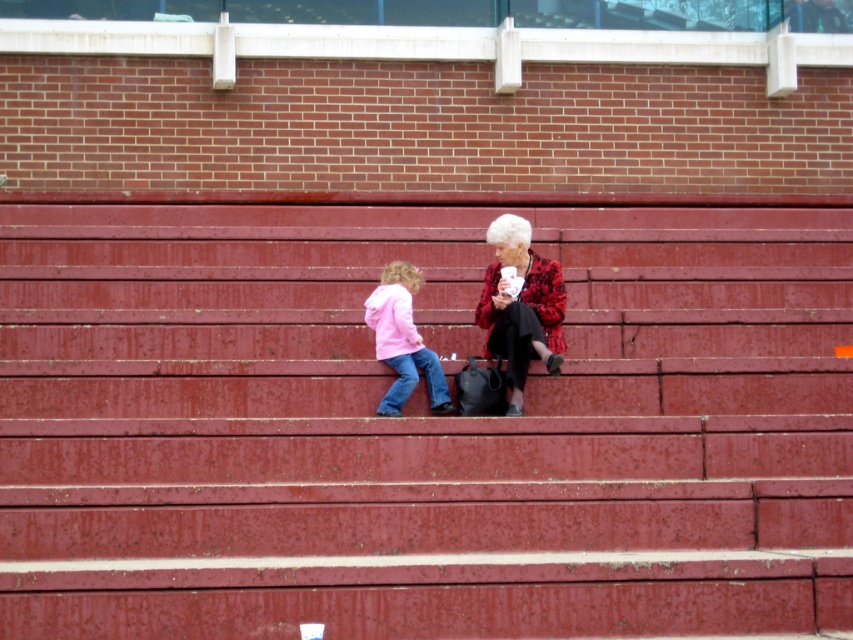
Can you confirm if smooth red stairs at center is smaller than red plaid jacket at center?

Yes.

This screenshot has height=640, width=853. Find the location of `smooth red stairs at center`. smooth red stairs at center is located at coordinates (419, 426).

Locate an element on the screen. The width and height of the screenshot is (853, 640). smooth red stairs at center is located at coordinates (419, 426).

Can you confirm if red plaid jacket at center is positioned to the right of matte pink jacket at lower left?

Correct, you'll find red plaid jacket at center to the right of matte pink jacket at lower left.

Measure the distance between red plaid jacket at center and camera.

red plaid jacket at center is 11.41 meters from camera.

Find the location of a particular element. red plaid jacket at center is located at coordinates (521, 307).

Is point (698, 557) positioned after point (434, 397)?

No, it is not.

Does smooth red stairs at center have a larger size compared to matte pink jacket at lower left?

No, smooth red stairs at center is not bigger than matte pink jacket at lower left.

Describe the element at coordinates (419, 426) in the screenshot. I see `smooth red stairs at center` at that location.

Locate an element on the screen. This screenshot has width=853, height=640. smooth red stairs at center is located at coordinates click(419, 426).